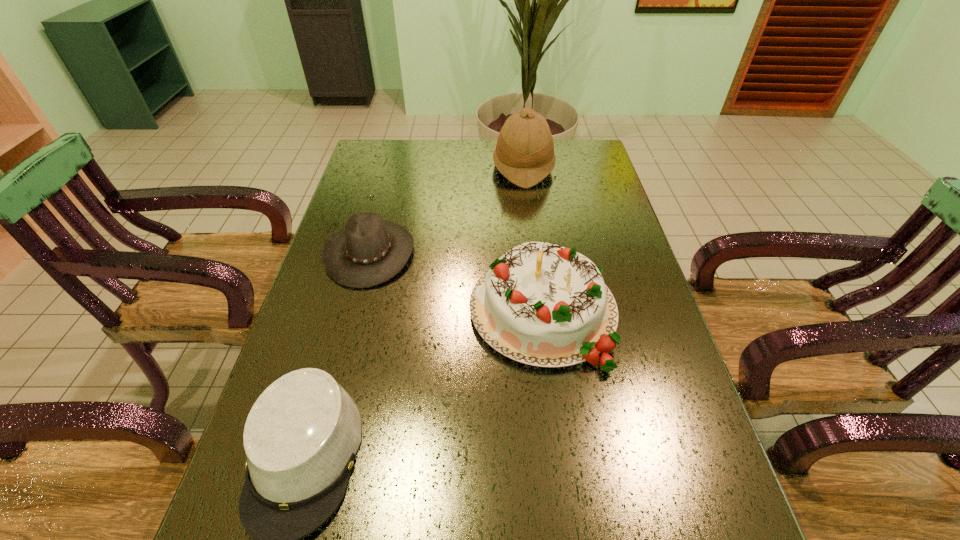
Locate an element on the screen. The image size is (960, 540). free space that satisfies the following two spatial constraints: 1. on the front-facing side of the cake; 2. on the left side of the second farthest hat is located at coordinates (354, 312).

This screenshot has height=540, width=960. What are the coordinates of `vacant region that satisfies the following two spatial constraints: 1. on the front-facing side of the second farthest hat; 2. on the right side of the cake` in the screenshot? It's located at (354, 312).